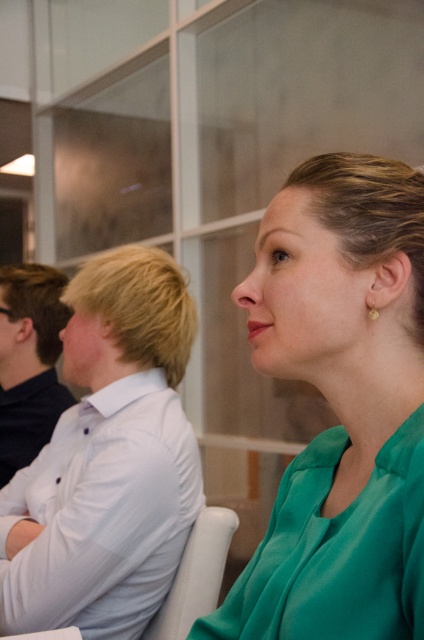
Is green satin blouse at center smaller than white shirt at left?

Indeed, green satin blouse at center has a smaller size compared to white shirt at left.

Where is `green satin blouse at center`? This screenshot has width=424, height=640. green satin blouse at center is located at coordinates (340, 406).